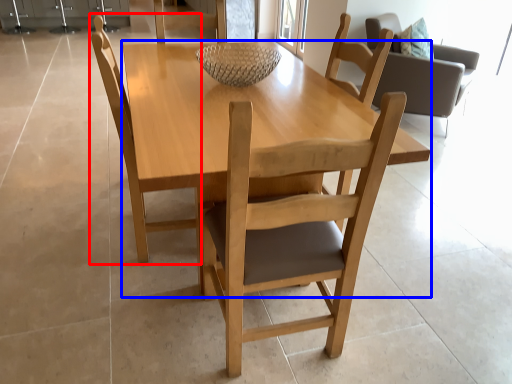
Question: Which object is closer to the camera taking this photo, chair (highlighted by a red box) or round table (highlighted by a blue box)?

Choices:
 (A) chair
 (B) round table

Answer: (B)